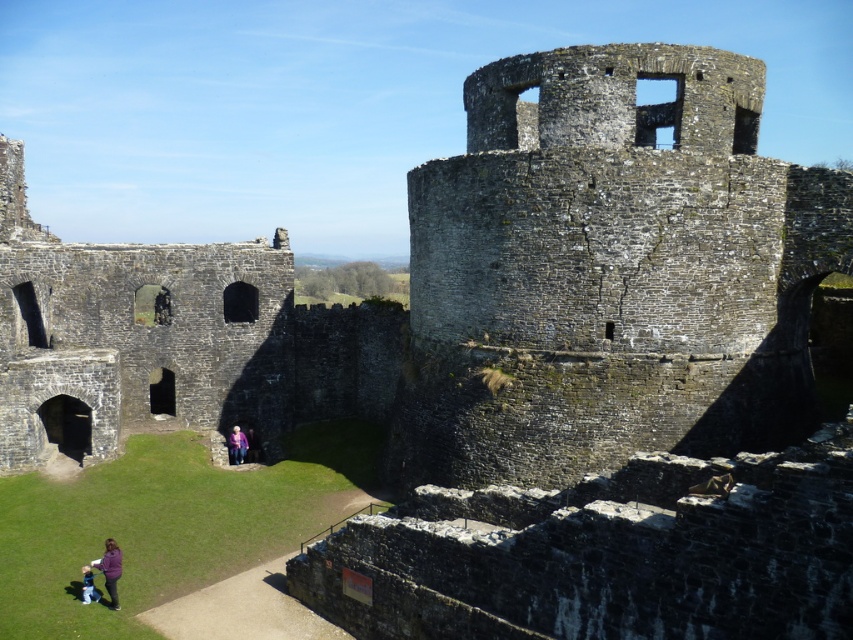
Question: Which point is closer to the camera taking this photo?

Choices:
 (A) (234, 432)
 (B) (108, 547)
 (C) (271, 284)
 (D) (90, 592)

Answer: (B)

Question: Is purple woolen sweater at center thinner than pink fabric at lower left?

Choices:
 (A) no
 (B) yes

Answer: (A)

Question: Observing the image, what is the correct spatial positioning of dark gray stone ruins at center in reference to purple woolen sweater at center?

Choices:
 (A) right
 (B) left

Answer: (B)

Question: Which of the following is the closest to the observer?

Choices:
 (A) (102, 564)
 (B) (778, 364)

Answer: (A)

Question: Is purple fleece jacket at lower left thinner than pink fabric at lower left?

Choices:
 (A) no
 (B) yes

Answer: (A)

Question: Estimate the real-world distances between objects in this image. Which object is farther from the purple fleece jacket at lower left?

Choices:
 (A) dark gray stone ruins at center
 (B) rusty stone tower at center

Answer: (A)